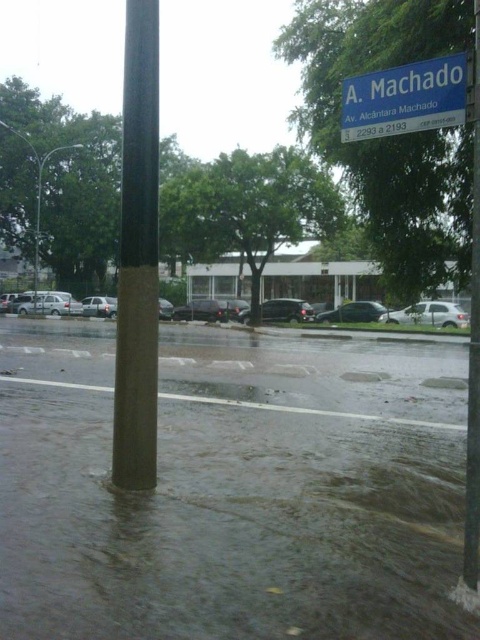
Is point (380, 90) positioned after point (211, 300)?

No, it is not.

Identify the location of blue plastic street sign at upper center. (408, 99).

You are a GUI agent. You are given a task and a screenshot of the screen. Output one action in this format:
    pyautogui.click(x=<x>, y=<y>)
    Task: Click on the blue plastic street sign at upper center
    
    Given the screenshot: What is the action you would take?
    pyautogui.click(x=408, y=99)

In order to click on blue plastic street sign at upper center in this screenshot , I will do `click(408, 99)`.

Is dark wet water at lower center wider than silver metallic sedan at center?

No.

Can you confirm if dark wet water at lower center is positioned below silver metallic sedan at center?

Correct, dark wet water at lower center is located below silver metallic sedan at center.

Where is `dark wet water at lower center`? This screenshot has height=640, width=480. dark wet water at lower center is located at coordinates (228, 522).

This screenshot has width=480, height=640. I want to click on dark wet water at lower center, so click(228, 522).

Can you confirm if satin black car at center is thinner than shiny silver sedan at center?

In fact, satin black car at center might be wider than shiny silver sedan at center.

Can you confirm if satin black car at center is positioned to the left of shiny silver sedan at center?

Incorrect, satin black car at center is not on the left side of shiny silver sedan at center.

Which is behind, point (273, 307) or point (201, 314)?

The point (201, 314) is more distant.

The width and height of the screenshot is (480, 640). I want to click on satin black car at center, so click(286, 310).